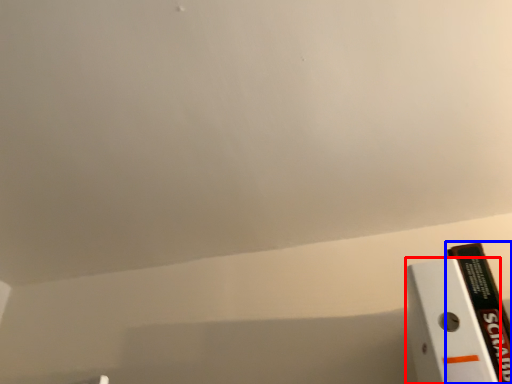
Question: Which object is further to the camera taking this photo, paperback book (highlighted by a red box) or book (highlighted by a blue box)?

Choices:
 (A) paperback book
 (B) book

Answer: (B)